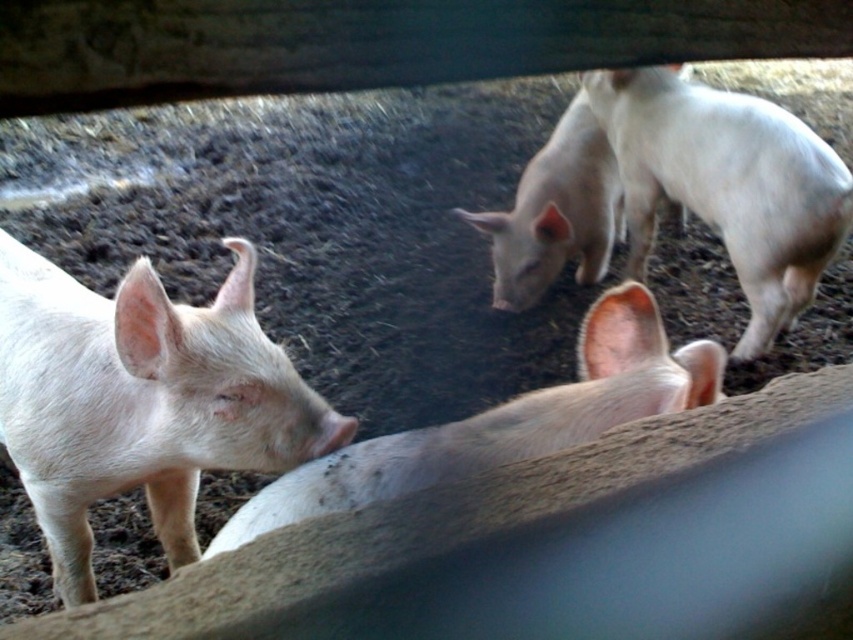
Question: Considering the relative positions of white matte pig at left and white matte pig at upper right in the image provided, where is white matte pig at left located with respect to white matte pig at upper right?

Choices:
 (A) below
 (B) above

Answer: (A)

Question: Can you confirm if matte pink piglet at center is positioned above white matte pig at center?

Choices:
 (A) no
 (B) yes

Answer: (A)

Question: Which object appears farthest from the camera in this image?

Choices:
 (A) matte pink piglet at center
 (B) white matte pig at center
 (C) white matte pig at left
 (D) white matte pig at upper right

Answer: (B)

Question: Is white matte pig at upper right wider than white matte pig at center?

Choices:
 (A) no
 (B) yes

Answer: (A)

Question: Estimate the real-world distances between objects in this image. Which object is farther from the white matte pig at upper right?

Choices:
 (A) matte pink piglet at center
 (B) white matte pig at left

Answer: (B)

Question: Which object is farther from the camera taking this photo?

Choices:
 (A) white matte pig at upper right
 (B) matte pink piglet at center

Answer: (A)